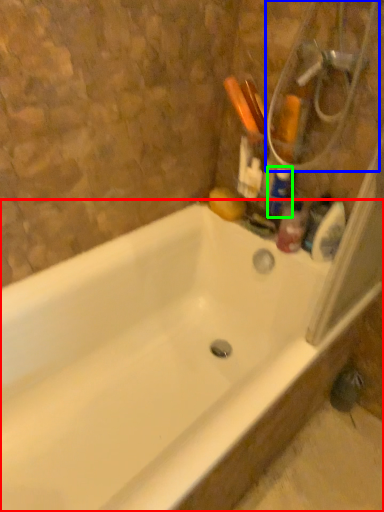
Question: Based on their relative distances, which object is farther from bathtub (highlighted by a red box)? Choose from shower (highlighted by a blue box) and cleaning product (highlighted by a green box).

Choices:
 (A) shower
 (B) cleaning product

Answer: (A)